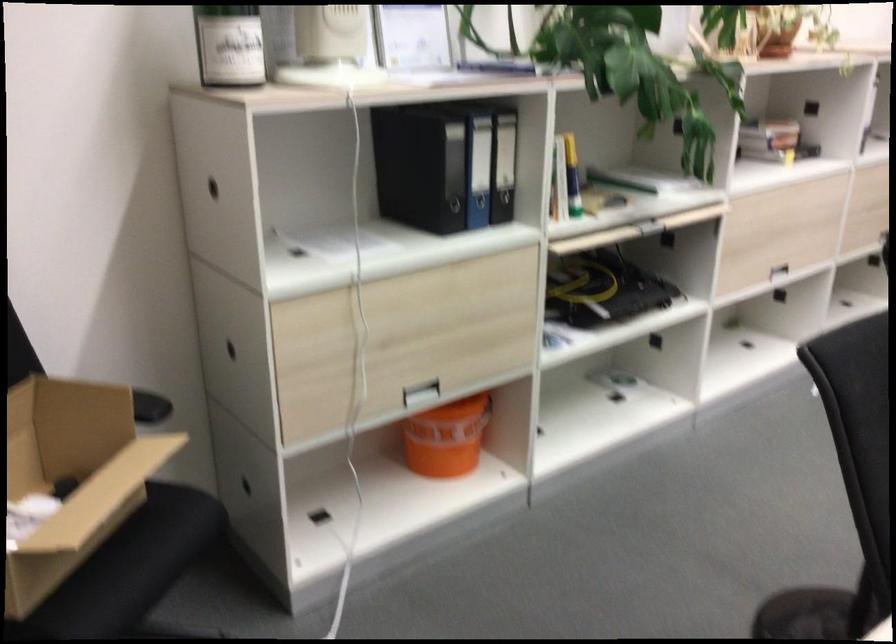
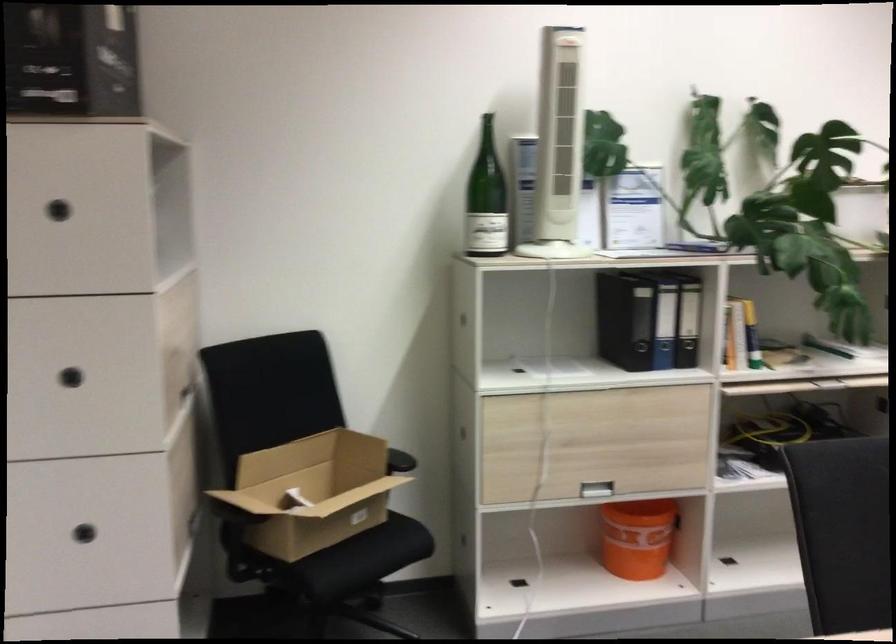
Question: The camera is either moving clockwise (left) or counter-clockwise (right) around the object. The first image is from the beginning of the video and the second image is from the end. Is the camera moving left or right when shooting the video?

Choices:
 (A) Left
 (B) Right

Answer: (B)